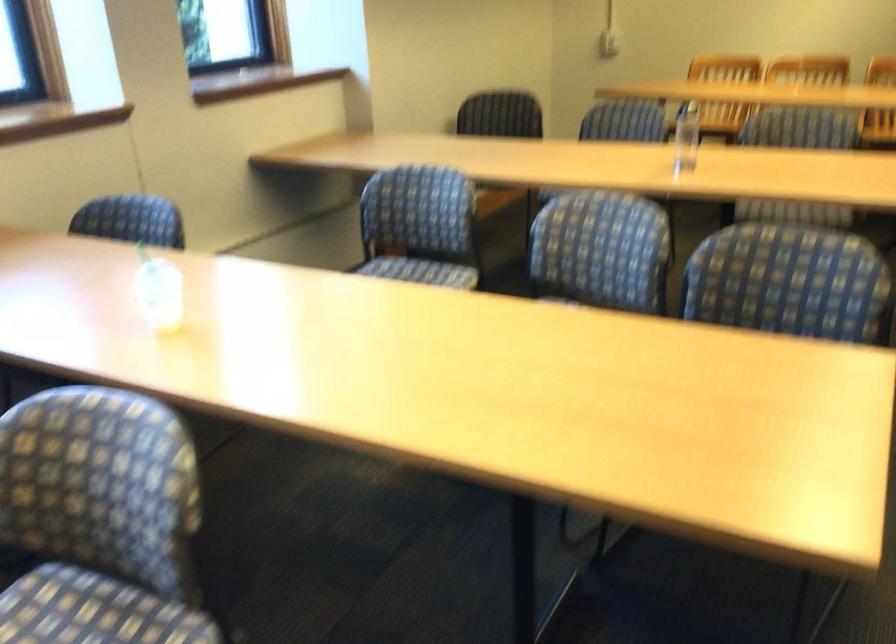
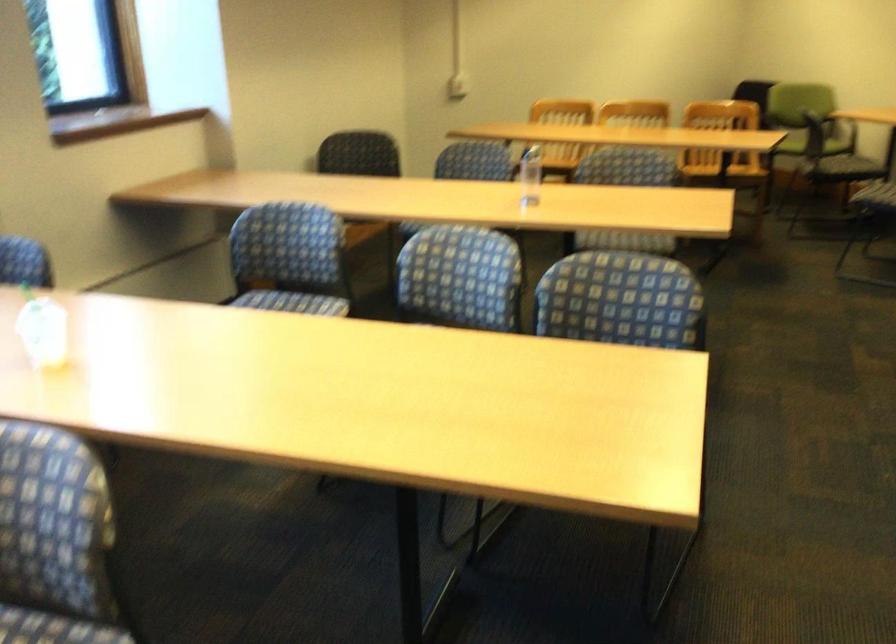
The point at (418, 225) is marked in the first image. Where is the corresponding point in the second image?

(289, 259)